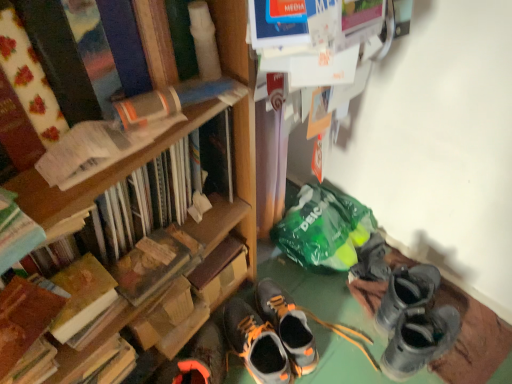
Question: Does hardcover book at left, marked as the 4th book in a bottom-to-top arrangement, have a greater width compared to gray suede sneakers at center, marked as the first footwear in a right-to-left arrangement?

Choices:
 (A) no
 (B) yes

Answer: (A)

Question: From the image's perspective, is hardcover book at left, marked as the 4th book in a bottom-to-top arrangement, above gray suede sneakers at center, which is the third footwear in left-to-right order?

Choices:
 (A) no
 (B) yes

Answer: (B)

Question: Is gray suede sneakers at center, marked as the first footwear in a right-to-left arrangement, inside hardcover book at left, which appears as the second book when viewed from the top?

Choices:
 (A) no
 (B) yes

Answer: (A)

Question: Is hardcover book at left, which appears as the second book when viewed from the top, looking in the opposite direction of gray suede sneakers at center, which is the third footwear in left-to-right order?

Choices:
 (A) no
 (B) yes

Answer: (A)

Question: Does hardcover book at left, which appears as the second book when viewed from the top, have a greater height compared to gray suede sneakers at center, which is the third footwear in left-to-right order?

Choices:
 (A) no
 (B) yes

Answer: (B)

Question: Can you confirm if hardcover book at left, which appears as the second book when viewed from the top, is smaller than gray suede sneakers at center, marked as the first footwear in a right-to-left arrangement?

Choices:
 (A) yes
 (B) no

Answer: (B)

Question: From the image's perspective, is hardcover book at left, which is the fifth book in top-to-bottom order, located above hardcover book at center?

Choices:
 (A) no
 (B) yes

Answer: (A)

Question: Can you confirm if hardcover book at left, which is the fifth book in top-to-bottom order, is shorter than hardcover book at center?

Choices:
 (A) yes
 (B) no

Answer: (B)

Question: Can we say hardcover book at left, which is the fifth book in top-to-bottom order, lies outside hardcover book at center?

Choices:
 (A) no
 (B) yes

Answer: (B)

Question: Does hardcover book at left, which is the fifth book in top-to-bottom order, have a smaller size compared to hardcover book at center?

Choices:
 (A) yes
 (B) no

Answer: (B)

Question: Considering the relative positions of hardcover book at left, which is the fifth book in top-to-bottom order, and hardcover book at center in the image provided, is hardcover book at left, which is the fifth book in top-to-bottom order, in front of hardcover book at center?

Choices:
 (A) no
 (B) yes

Answer: (B)

Question: From a real-world perspective, is hardcover book at left, marked as the first book in a bottom-to-top arrangement, below hardcover book at center?

Choices:
 (A) no
 (B) yes

Answer: (A)

Question: Can hardcover book at left, which is the 1th book in top-to-bottom order, be found inside hardcover book at left, which appears as the third book when ordered from the bottom?

Choices:
 (A) yes
 (B) no

Answer: (B)